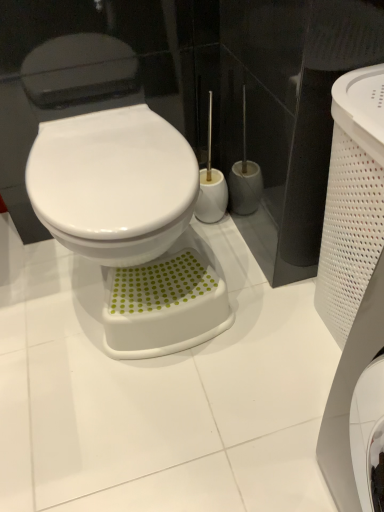
This screenshot has width=384, height=512. Find the location of `unoccupied region to the right of green dotted plastic step stool at lower center`. unoccupied region to the right of green dotted plastic step stool at lower center is located at coordinates (259, 321).